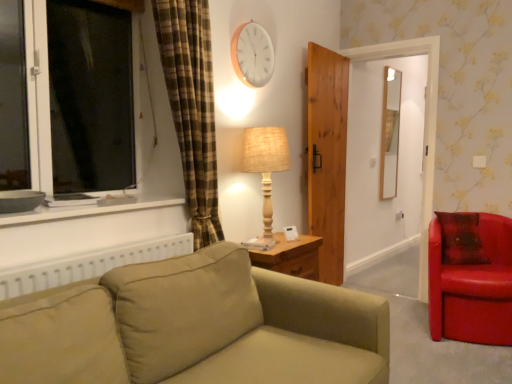
What do you see at coordinates (196, 327) in the screenshot? This screenshot has height=384, width=512. I see `matte beige couch at center` at bounding box center [196, 327].

What do you see at coordinates (327, 156) in the screenshot? I see `wooden door at center` at bounding box center [327, 156].

The width and height of the screenshot is (512, 384). Find the location of `matte gray bowl at left`. matte gray bowl at left is located at coordinates (20, 200).

Describe the element at coordinates (20, 200) in the screenshot. I see `matte gray bowl at left` at that location.

Describe the element at coordinates (265, 167) in the screenshot. I see `woven beige lamp at center` at that location.

I want to click on woven beige lamp at center, so click(x=265, y=167).

I want to click on wooden clock at upper center, so click(252, 54).

The image size is (512, 384). What do you see at coordinates (390, 133) in the screenshot?
I see `matte wooden mirror at upper right` at bounding box center [390, 133].

Where is `matte beige couch at center`? Image resolution: width=512 pixels, height=384 pixels. matte beige couch at center is located at coordinates (196, 327).

From the image's perspective, is matte wooden mirror at upper right on woven beige lamp at center?

Yes, from the image's perspective, matte wooden mirror at upper right is above woven beige lamp at center.

How distant is matte wooden mirror at upper right from woven beige lamp at center?

matte wooden mirror at upper right is 2.34 meters away from woven beige lamp at center.

Considering the positions of objects matte wooden mirror at upper right and woven beige lamp at center in the image provided, who is in front, matte wooden mirror at upper right or woven beige lamp at center?

woven beige lamp at center.

Between matte wooden mirror at upper right and woven beige lamp at center, which one has smaller width?

matte wooden mirror at upper right is thinner.

Is wooden door at center wider or thinner than matte beige couch at center?

Clearly, wooden door at center has less width compared to matte beige couch at center.

From a real-world perspective, between wooden door at center and matte beige couch at center, who is vertically lower?

In real-world perspective, matte beige couch at center is lower.

Is wooden door at center facing away from matte beige couch at center?

No, wooden door at center is not facing away from matte beige couch at center.

Is woven beige lamp at center not within shiny leather armchair at right?

Yes, woven beige lamp at center is located beyond the bounds of shiny leather armchair at right.

Considering the positions of objects woven beige lamp at center and shiny leather armchair at right in the image provided, who is behind, woven beige lamp at center or shiny leather armchair at right?

shiny leather armchair at right.

Where is `chair on the right of woven beige lamp at center`? The width and height of the screenshot is (512, 384). chair on the right of woven beige lamp at center is located at coordinates (471, 278).

Which point is more forward, (x=264, y=217) or (x=341, y=257)?

Point (x=264, y=217)

How much distance is there between woven beige lamp at center and wooden door at center?

woven beige lamp at center is 92.87 centimeters away from wooden door at center.

From the picture: Is the surface of woven beige lamp at center in direct contact with wooden door at center?

No.

Considering their positions, is woven beige lamp at center located in front of or behind matte gray bowl at left?

woven beige lamp at center is positioned farther from the viewer than matte gray bowl at left.

From the image's perspective, is woven beige lamp at center under matte gray bowl at left?

Incorrect, from the image's perspective, woven beige lamp at center is higher than matte gray bowl at left.

Can you confirm if woven beige lamp at center is shorter than matte gray bowl at left?

No.

Is woven beige lamp at center not within matte gray bowl at left?

Indeed, woven beige lamp at center is completely outside matte gray bowl at left.

From a real-world perspective, is woven beige lamp at center on top of matte wooden mirror at upper right?

Incorrect, from a real-world perspective, woven beige lamp at center is lower than matte wooden mirror at upper right.

Considering the positions of point (281, 136) and point (385, 91), is point (281, 136) closer or farther from the camera than point (385, 91)?

Point (281, 136) is positioned closer to the camera compared to point (385, 91).

Considering the relative positions of woven beige lamp at center and matte wooden mirror at upper right in the image provided, is woven beige lamp at center to the left of matte wooden mirror at upper right from the viewer's perspective?

Yes.

From the image's perspective, is woven beige lamp at center located above or below matte wooden mirror at upper right?

Clearly, from the image's perspective, woven beige lamp at center is below matte wooden mirror at upper right.

Is shiny leather armchair at right taller than woven beige lamp at center?

Correct, shiny leather armchair at right is much taller as woven beige lamp at center.

Is shiny leather armchair at right facing away from woven beige lamp at center?

shiny leather armchair at right does not have its back to woven beige lamp at center.

From the image's perspective, which is below, shiny leather armchair at right or woven beige lamp at center?

From the image's view, shiny leather armchair at right is below.

The image size is (512, 384). Find the location of `mirror behind the woven beige lamp at center`. mirror behind the woven beige lamp at center is located at coordinates [390, 133].

The height and width of the screenshot is (384, 512). In the image, there is a wooden door at center. Find the location of `studio couch below it (from a real-world perspective)`. studio couch below it (from a real-world perspective) is located at coordinates (196, 327).

From the image, which object appears to be farther from shiny leather armchair at right, woven beige lamp at center or matte wooden mirror at upper right?

matte wooden mirror at upper right lies further to shiny leather armchair at right than the other object.

Based on the photo, based on their spatial positions, is matte beige couch at center or matte wooden mirror at upper right closer to matte gray bowl at left?

The object closer to matte gray bowl at left is matte beige couch at center.

When comparing their distances from matte wooden mirror at upper right, does matte gray bowl at left or wooden clock at upper center seem closer?

Among the two, wooden clock at upper center is located nearer to matte wooden mirror at upper right.

Based on their spatial positions, is wooden door at center or wooden clock at upper center closer to shiny leather armchair at right?

Based on the image, wooden door at center appears to be nearer to shiny leather armchair at right.

Considering their positions, is matte gray bowl at left positioned further to matte wooden mirror at upper right than wooden door at center?

matte gray bowl at left.

Based on their spatial positions, is matte wooden mirror at upper right or matte beige couch at center further from shiny leather armchair at right?

Based on the image, matte wooden mirror at upper right appears to be further to shiny leather armchair at right.

Looking at the image, which one is located further to matte wooden mirror at upper right, woven beige lamp at center or shiny leather armchair at right?

woven beige lamp at center.

Considering their positions, is matte gray bowl at left positioned further to wooden door at center than wooden clock at upper center?

The object further to wooden door at center is matte gray bowl at left.

You are a GUI agent. You are given a task and a screenshot of the screen. Output one action in this format:
    pyautogui.click(x=<x>, y=<y>)
    Task: Click on the lamp positioned between matte beige couch at center and shiny leather armchair at right from near to far
    This screenshot has width=512, height=384.
    Given the screenshot: What is the action you would take?
    pyautogui.click(x=265, y=167)

Identify the location of clock located between matte gray bowl at left and matte wooden mirror at upper right in the depth direction. This screenshot has height=384, width=512. (252, 54).

The height and width of the screenshot is (384, 512). I want to click on door between matte beige couch at center and matte wooden mirror at upper right in the front-back direction, so click(327, 156).

Where is `studio couch located between matte gray bowl at left and shiny leather armchair at right in the left-right direction`? Image resolution: width=512 pixels, height=384 pixels. studio couch located between matte gray bowl at left and shiny leather armchair at right in the left-right direction is located at coordinates (196, 327).